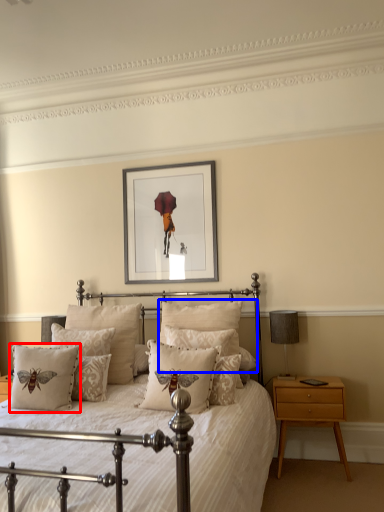
Question: Which of the following is the closest to the observer, pillow (highlighted by a red box) or pillow (highlighted by a blue box)?

Choices:
 (A) pillow
 (B) pillow

Answer: (A)